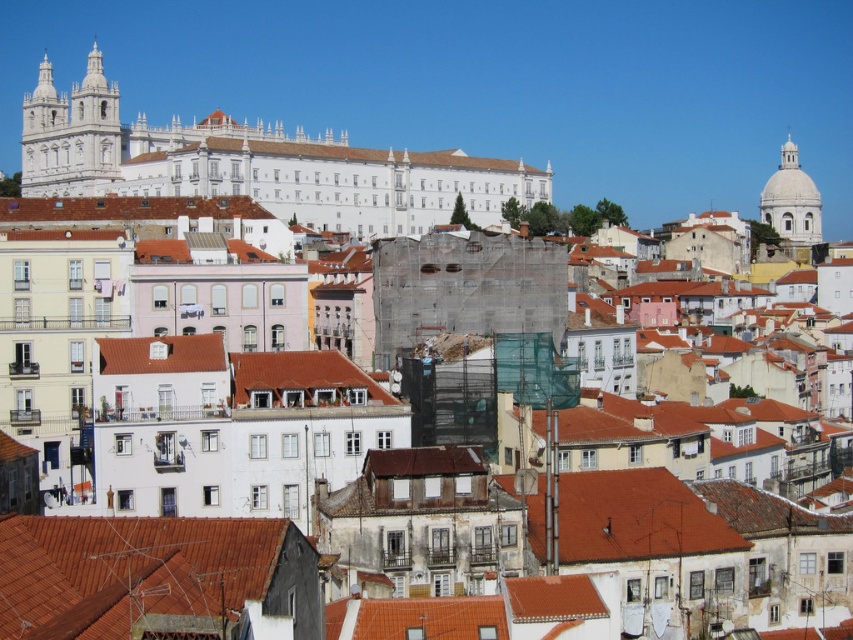
Question: Among these objects, which one is farthest from the camera?

Choices:
 (A) white smooth building at center
 (B) white marble dome at upper right
 (C) white marble tower at upper left
 (D) brown tile roof at center

Answer: (C)

Question: Observing the image, what is the correct spatial positioning of brown tile roof at center in reference to white smooth building at center?

Choices:
 (A) right
 (B) left

Answer: (A)

Question: Is brown tile roof at center bigger than red tile roof at center?

Choices:
 (A) no
 (B) yes

Answer: (B)

Question: Which point is farther from the camera taking this photo?

Choices:
 (A) (343, 161)
 (B) (793, 227)

Answer: (B)

Question: Is brown tile roof at center to the left of white marble dome at upper right from the viewer's perspective?

Choices:
 (A) yes
 (B) no

Answer: (A)

Question: Which object is the farthest from the red tile roof at center?

Choices:
 (A) brown tile roof at center
 (B) white marble tower at upper left
 (C) white smooth building at center

Answer: (B)